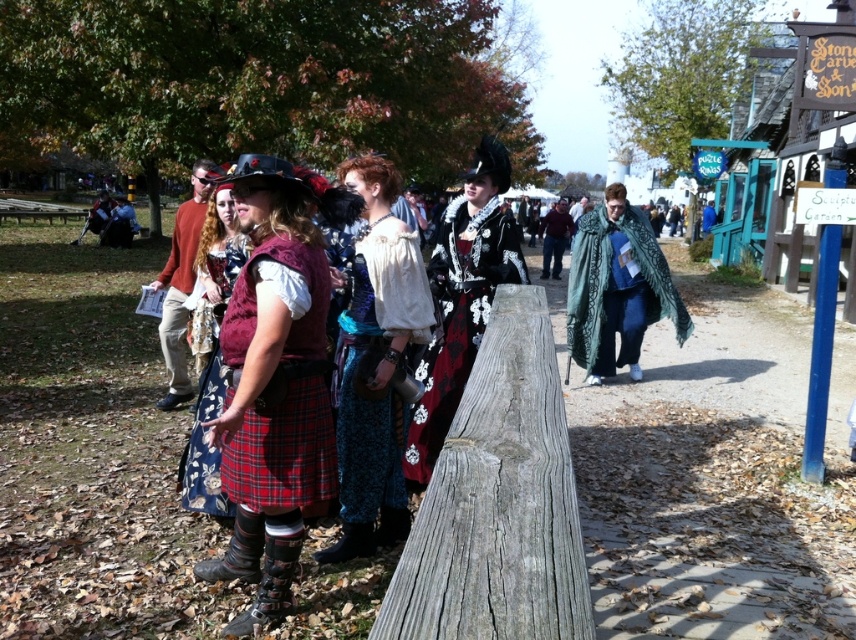
You are a photographer at the event and need to capture both the green textured cloak at center and the dark green cloak at right in a single shot. Based on their positions, which cloak should you focus on first to ensure both are in frame?

The green textured cloak at center is located below the dark green cloak at right, so focusing on the dark green cloak at right first will allow you to adjust the camera angle downward to include the green textured cloak at center in the frame.

You are a photographer standing in the park and want to take a photo of both the green textured cloak at center and the dark green cloak at right. Which cloak should you focus on first to ensure both are in clear view?

You should focus on the green textured cloak at center first because it is closer to you than the dark green cloak at right. By focusing on the closer object, you can achieve a depth of field that keeps both cloaks in focus.